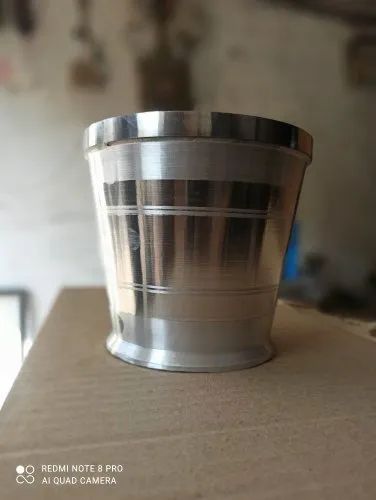
Identify the location of metal cup. (201, 233).